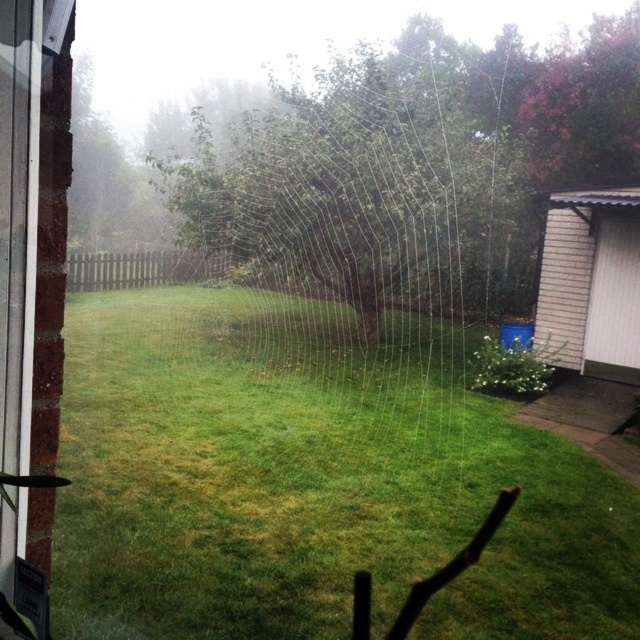
You are looking through a window at a backyard scene. You notice two points marked in the image. The first point is at coordinates point (x=259, y=276), and the second is at point (x=3, y=179). Which of these two points is closer to the window?

Point (x=3, y=179) is closer to the window because it is closer to the camera than point (x=259, y=276).

You are trying to exit the house through the clear glass window at left and the white plastic screen door at right. Which one is lower and thus easier to reach?

The clear glass window at left is located below the white plastic screen door at right, so it is lower and easier to reach.